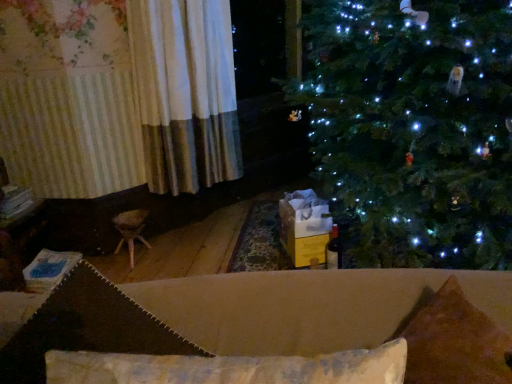
The height and width of the screenshot is (384, 512). Identify the location of white textured curtain at left. (185, 92).

What do you see at coordinates (185, 92) in the screenshot?
I see `white textured curtain at left` at bounding box center [185, 92].

Locate an element on the screen. The width and height of the screenshot is (512, 384). white textured curtain at left is located at coordinates (185, 92).